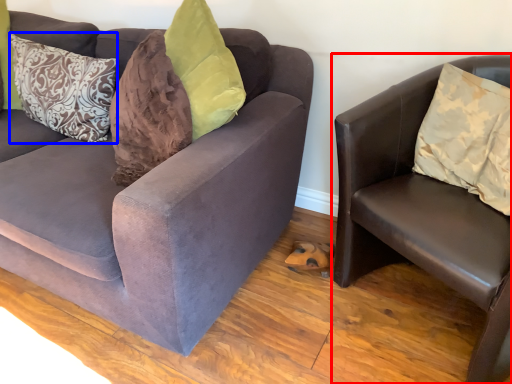
Question: Which object is further to the camera taking this photo, studio couch (highlighted by a red box) or pillow (highlighted by a blue box)?

Choices:
 (A) studio couch
 (B) pillow

Answer: (B)